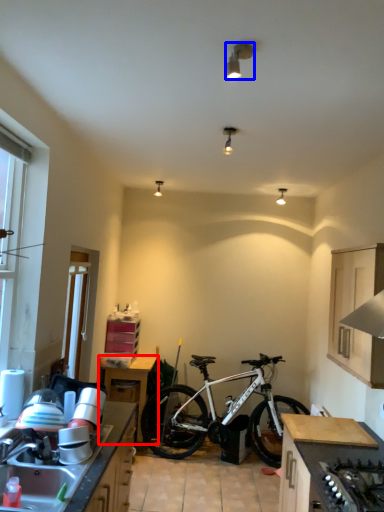
Question: Which object is further to the camera taking this photo, table (highlighted by a red box) or lamp (highlighted by a blue box)?

Choices:
 (A) table
 (B) lamp

Answer: (A)